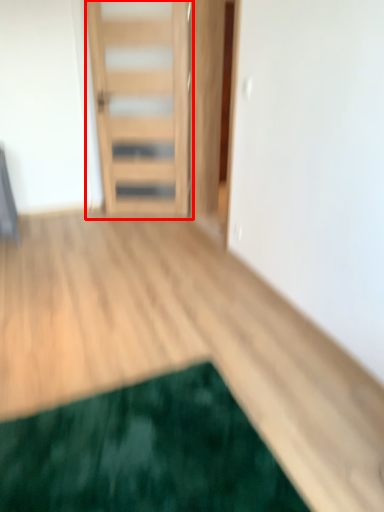
Question: From the image's perspective, considering the relative positions of door (annotated by the red box) and mat in the image provided, where is door (annotated by the red box) located with respect to the staircase?

Choices:
 (A) above
 (B) below

Answer: (A)